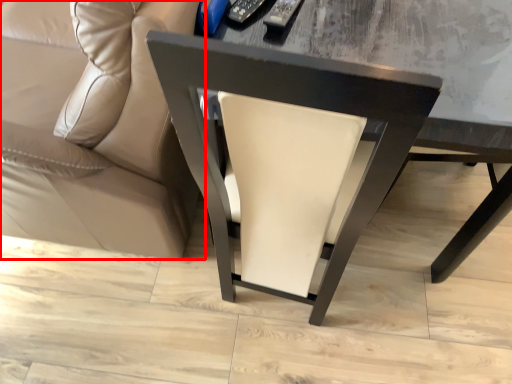
Question: From the image's perspective, what is the correct spatial relationship of studio couch (annotated by the red box) in relation to chair?

Choices:
 (A) above
 (B) below

Answer: (A)